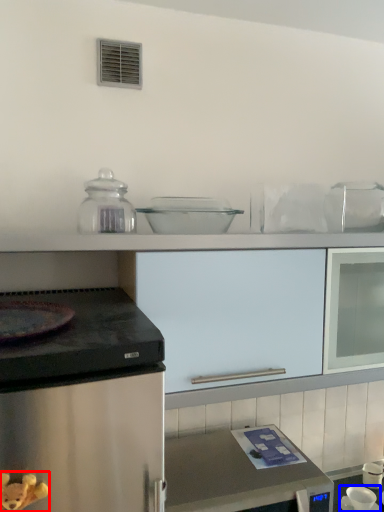
Question: Which point is further to the camera, toy (highlighted by a red box) or appliance (highlighted by a blue box)?

Choices:
 (A) toy
 (B) appliance

Answer: (B)